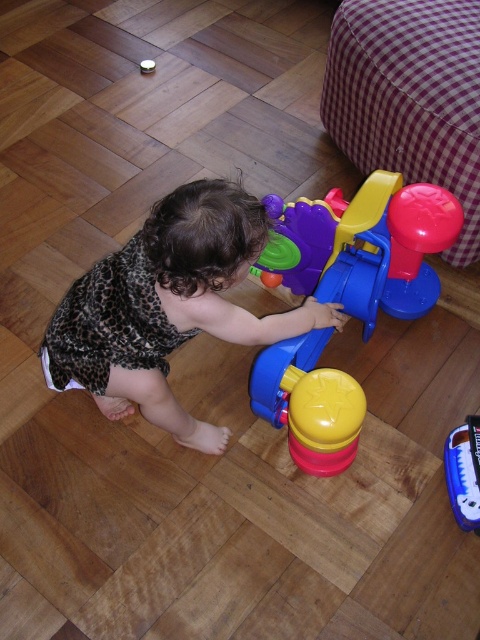
Question: Which point is farther from the camera taking this photo?

Choices:
 (A) (101, 264)
 (B) (408, 241)

Answer: (B)

Question: Does rubberized plastic toy at center appear under blue plastic toy at center?

Choices:
 (A) no
 (B) yes

Answer: (A)

Question: Which is nearer to the leopard print dress at center?

Choices:
 (A) rubberized plastic toy at center
 (B) blue plastic toy at center

Answer: (A)

Question: Is leopard print dress at center bigger than blue plastic toy at center?

Choices:
 (A) no
 (B) yes

Answer: (B)

Question: Which of these objects is positioned farthest from the leopard print dress at center?

Choices:
 (A) rubberized plastic toy at center
 (B) blue plastic toy at center

Answer: (B)

Question: Is leopard print dress at center bigger than blue plastic toy at center?

Choices:
 (A) yes
 (B) no

Answer: (A)